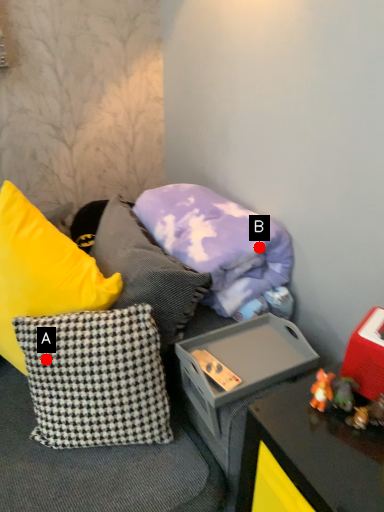
Question: Two points are circled on the image, labeled by A and B beside each circle. Which of the following is the closest to the observer?

Choices:
 (A) A is closer
 (B) B is closer

Answer: (A)